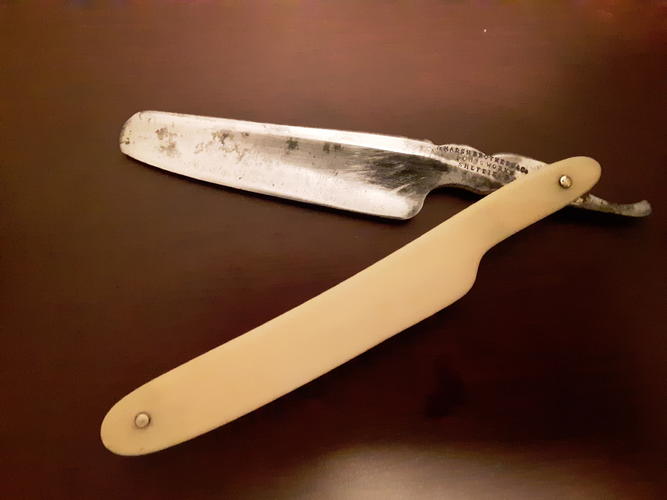
Where is `brown table`? brown table is located at coordinates (344, 64).